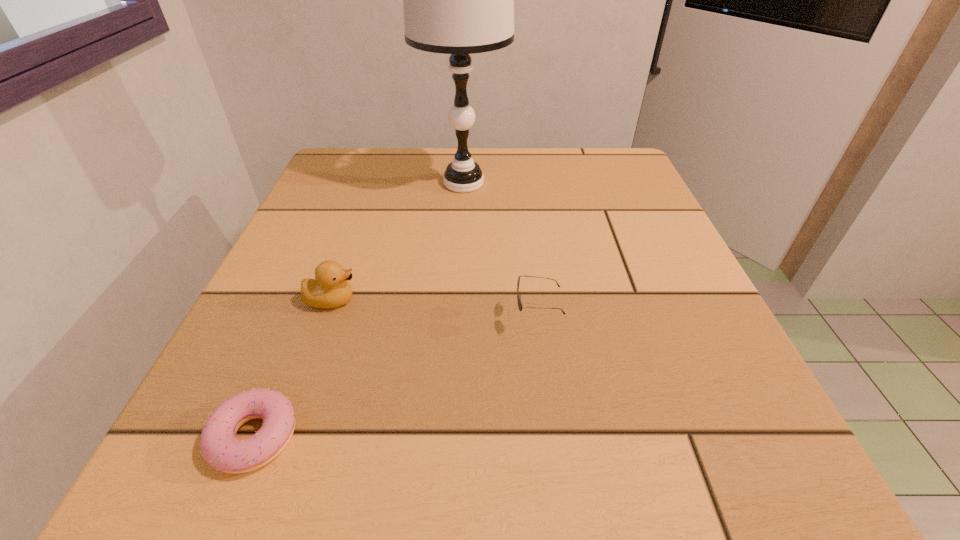
Locate an element on the screen. The height and width of the screenshot is (540, 960). empty location between the sunglasses and the tallest object is located at coordinates (500, 251).

Identify the location of empty location between the sunglasses and the duckling. This screenshot has width=960, height=540. 434,309.

Locate an element on the screen. This screenshot has height=540, width=960. free area in between the duckling and the nearest object is located at coordinates (293, 368).

You are a GUI agent. You are given a task and a screenshot of the screen. Output one action in this format:
    pyautogui.click(x=<x>, y=<y>)
    Task: Click on the vacant space that's between the table lamp and the duckling
    Image resolution: width=960 pixels, height=540 pixels.
    Given the screenshot: What is the action you would take?
    pyautogui.click(x=397, y=241)

Locate which object is the closest to the table lamp. Please provide its 2D coordinates. Your answer should be formatted as a tuple, i.e. [(x, y)], where the tuple contains the x and y coordinates of a point satisfying the conditions above.

[(520, 305)]

Select which object appears as the second closest to the sunglasses. Please provide its 2D coordinates. Your answer should be formatted as a tuple, i.e. [(x, y)], where the tuple contains the x and y coordinates of a point satisfying the conditions above.

[(330, 289)]

You are a GUI agent. You are given a task and a screenshot of the screen. Output one action in this format:
    pyautogui.click(x=<x>, y=<y>)
    Task: Click on the vacant space that satisfies the following two spatial constraints: 1. on the back side of the shortest object; 2. on the right side of the table lamp
    
    Given the screenshot: What is the action you would take?
    pyautogui.click(x=357, y=183)

At what (x,y) coordinates should I click in order to perform the action: click on free spot that satisfies the following two spatial constraints: 1. on the front side of the tallest object; 2. on the face of the duckling. Please return your answer as a coordinate pair (x, y). Looking at the image, I should click on (457, 300).

The width and height of the screenshot is (960, 540). I want to click on blank area in the image that satisfies the following two spatial constraints: 1. on the face of the duckling; 2. on the front side of the nearest object, so click(284, 437).